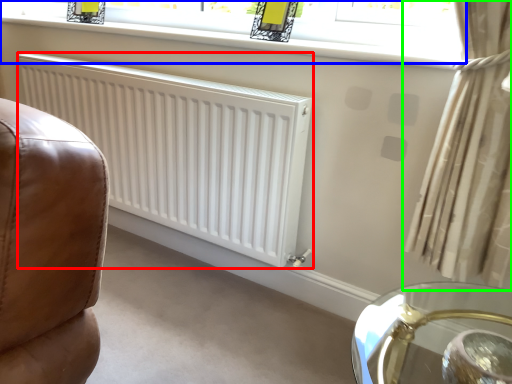
Question: Estimate the real-world distances between objects in this image. Which object is farther from radiator (highlighted by a red box), window (highlighted by a blue box) or curtain (highlighted by a green box)?

Choices:
 (A) window
 (B) curtain

Answer: (B)